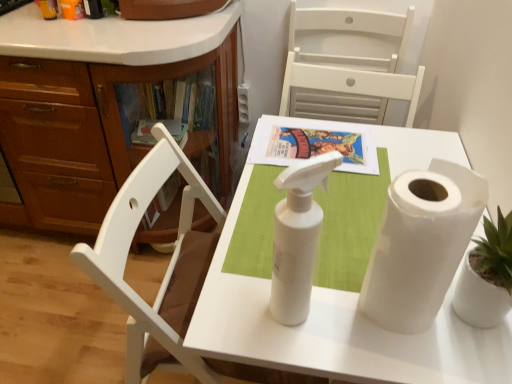
Where is `empty space that is to the right of matte paper book at center`? The width and height of the screenshot is (512, 384). empty space that is to the right of matte paper book at center is located at coordinates (408, 150).